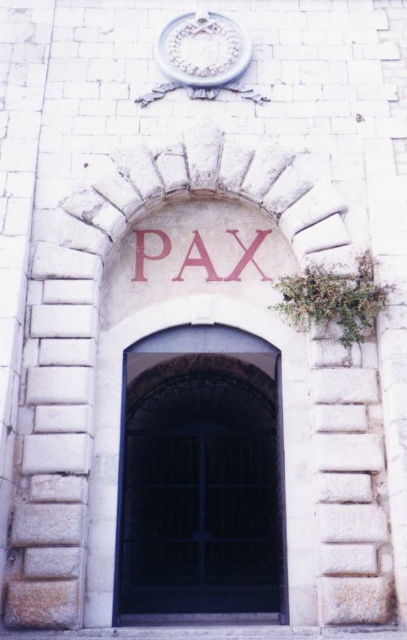
Question: Which point is closer to the camera?

Choices:
 (A) (280, 419)
 (B) (201, 256)

Answer: (A)

Question: Does black metal gate at center have a lesser width compared to white stone clock at upper center?

Choices:
 (A) yes
 (B) no

Answer: (A)

Question: Can you confirm if black metal gate at center is bigger than red stone lettering at center?

Choices:
 (A) no
 (B) yes

Answer: (A)

Question: Which point is farther from the camera taking this photo?

Choices:
 (A) pyautogui.click(x=188, y=67)
 (B) pyautogui.click(x=129, y=536)

Answer: (B)

Question: Which of the following is the closest to the observer?

Choices:
 (A) black metal gate at center
 (B) red stone lettering at center

Answer: (A)

Question: Is white stone clock at upper center to the right of red stone lettering at center from the viewer's perspective?

Choices:
 (A) no
 (B) yes

Answer: (A)